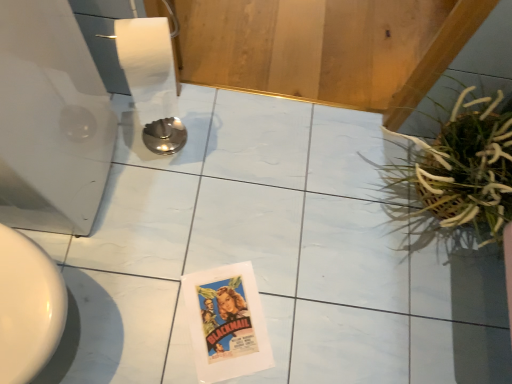
Question: Can you confirm if white glossy toilet at left is taller than green leafy plant at right?

Choices:
 (A) yes
 (B) no

Answer: (A)

Question: Considering the relative sizes of white glossy toilet at left and green leafy plant at right in the image provided, is white glossy toilet at left wider than green leafy plant at right?

Choices:
 (A) yes
 (B) no

Answer: (A)

Question: Is green leafy plant at right located within white glossy toilet at left?

Choices:
 (A) yes
 (B) no

Answer: (B)

Question: Is white glossy toilet at left outside of green leafy plant at right?

Choices:
 (A) yes
 (B) no

Answer: (A)

Question: Is white glossy toilet at left placed right next to green leafy plant at right?

Choices:
 (A) no
 (B) yes

Answer: (A)

Question: Can you confirm if white glossy toilet at left is smaller than green leafy plant at right?

Choices:
 (A) yes
 (B) no

Answer: (B)

Question: Is green leafy plant at right closer to the viewer compared to white glossy toilet at left?

Choices:
 (A) no
 (B) yes

Answer: (A)

Question: Is green leafy plant at right shorter than white glossy toilet at left?

Choices:
 (A) no
 (B) yes

Answer: (B)

Question: Is green leafy plant at right to the right of white glossy toilet at left from the viewer's perspective?

Choices:
 (A) yes
 (B) no

Answer: (A)

Question: Considering the relative positions of green leafy plant at right and white glossy toilet at left in the image provided, is green leafy plant at right to the left of white glossy toilet at left from the viewer's perspective?

Choices:
 (A) no
 (B) yes

Answer: (A)

Question: Does green leafy plant at right have a larger size compared to white glossy toilet at left?

Choices:
 (A) yes
 (B) no

Answer: (B)

Question: From the image's perspective, is green leafy plant at right on white glossy toilet at left?

Choices:
 (A) yes
 (B) no

Answer: (B)

Question: Is green leafy plant at right in front of or behind white glossy toilet at left in the image?

Choices:
 (A) front
 (B) behind

Answer: (B)